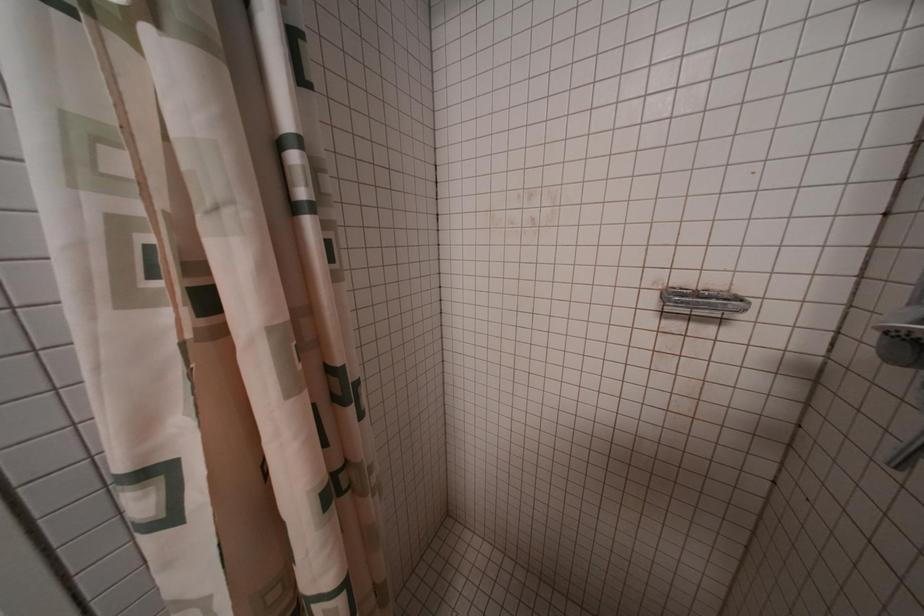
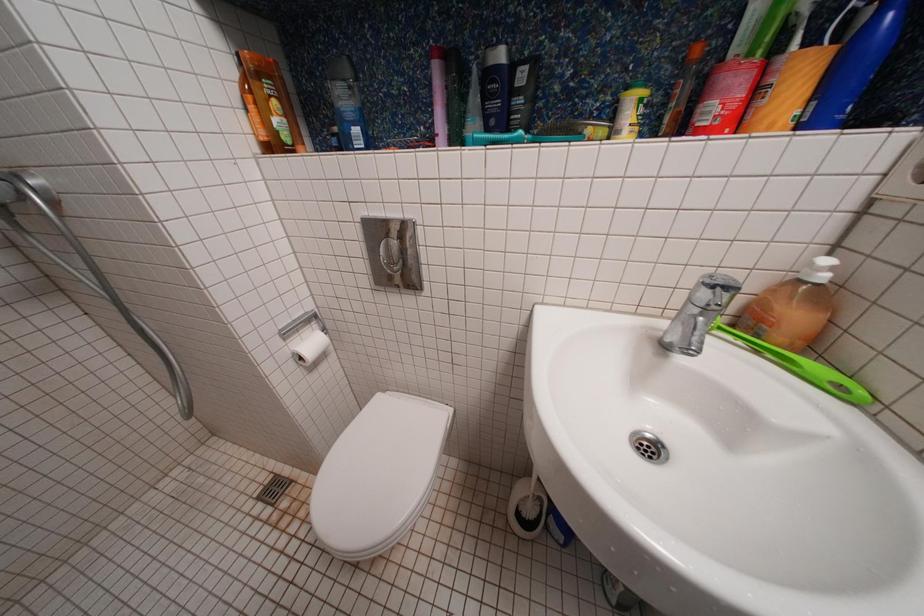
The first image is from the beginning of the video and the second image is from the end. How did the camera likely rotate when shooting the video?

The camera's rotation is toward right-down.